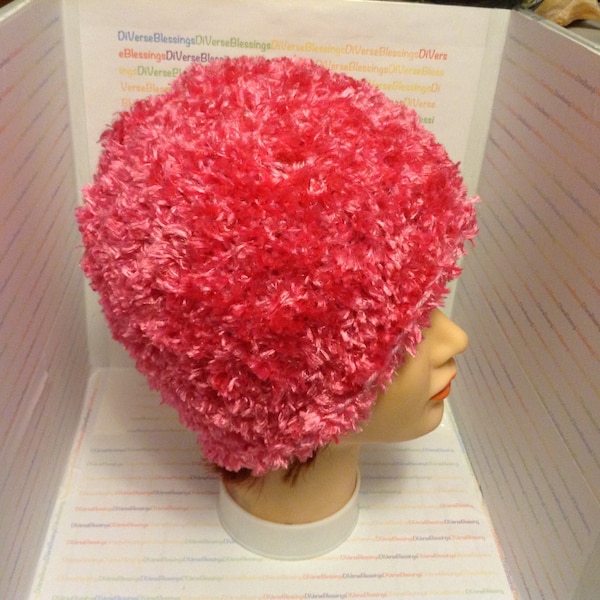
Locate an element on the screen. This screenshot has width=600, height=600. mannequin head is located at coordinates (380, 421).